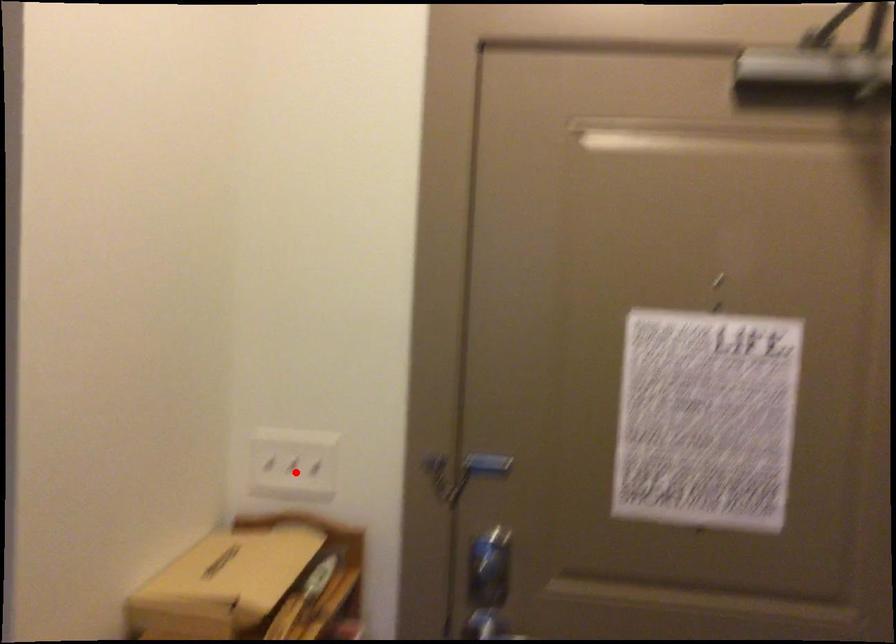
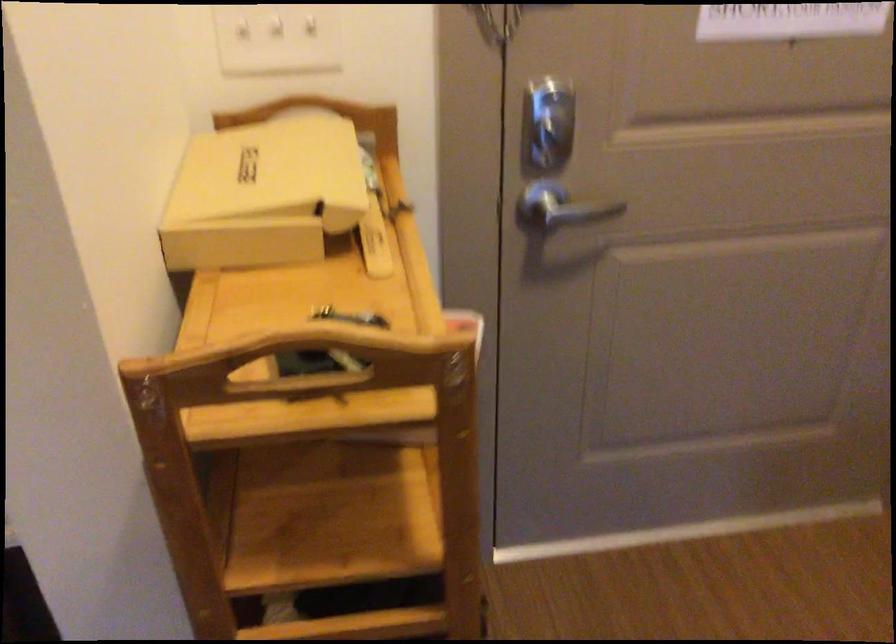
Where in the second image is the point corresponding to the highlighted location from the first image?

(276, 39)